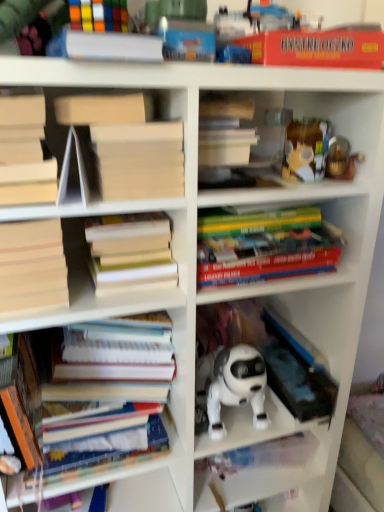
What do you see at coordinates (79, 398) in the screenshot?
I see `hardcover books at left, positioned as the seventh book in top-to-bottom order` at bounding box center [79, 398].

This screenshot has height=512, width=384. I want to click on white matte paper at upper center, the 1th paperback book from the left, so click(110, 46).

Locate an element on the screen. This screenshot has width=384, height=512. hardcover books at center, which is the fourth book in bottom-to-top order is located at coordinates (266, 246).

What do you see at coordinates (341, 159) in the screenshot? I see `metallic gold figurine at upper right, placed as the 2th toy when sorted from left to right` at bounding box center [341, 159].

Describe the element at coordinates (232, 142) in the screenshot. I see `hardcover book at center, the 6th book from the bottom` at that location.

This screenshot has height=512, width=384. I want to click on light brown cardboard book at left, the second book ordered from the bottom, so click(32, 267).

Is hardcover books at center, which ranks as the 5th book in top-to-bottom order, at the right side of translucent plastic container at upper right, arranged as the second toy when viewed from the right?

Incorrect, hardcover books at center, which ranks as the 5th book in top-to-bottom order, is not on the right side of translucent plastic container at upper right, arranged as the second toy when viewed from the right.

Is hardcover books at center, which ranks as the 5th book in top-to-bottom order, in front of or behind translucent plastic container at upper right, arranged as the second toy when viewed from the right, in the image?

Clearly, hardcover books at center, which ranks as the 5th book in top-to-bottom order, is in front of translucent plastic container at upper right, arranged as the second toy when viewed from the right.

Which point is more distant from viewer, (116,275) or (295,153)?

The point (295,153) is farther from the camera.

Is hardcover books at center, which ranks as the 5th book in top-to-bottom order, facing towards translucent plastic container at upper right, which is counted as the 1th toy, starting from the left?

No, hardcover books at center, which ranks as the 5th book in top-to-bottom order, is not aimed at translucent plastic container at upper right, which is counted as the 1th toy, starting from the left.

The height and width of the screenshot is (512, 384). Find the location of `the 2nd toy to the right of the rubberized plastic toy at upper center, counting from the anchor's position`. the 2nd toy to the right of the rubberized plastic toy at upper center, counting from the anchor's position is located at coordinates pyautogui.click(x=341, y=159).

Is metallic gold figurine at upper right, the first toy positioned from the right, to the right of rubberized plastic toy at upper center from the viewer's perspective?

Correct, you'll find metallic gold figurine at upper right, the first toy positioned from the right, to the right of rubberized plastic toy at upper center.

From a real-world perspective, which is physically below, metallic gold figurine at upper right, placed as the 2th toy when sorted from left to right, or rubberized plastic toy at upper center?

metallic gold figurine at upper right, placed as the 2th toy when sorted from left to right.

Find the location of a particular element. the 1st book directly above the hardcover books at center, which is the fourth book in bottom-to-top order (from a real-world perspective) is located at coordinates (232, 142).

Who is more distant, hardcover book at center, the 6th book from the bottom, or hardcover books at center, which is the fourth book from top to bottom?

hardcover book at center, the 6th book from the bottom, is behind.

How many degrees apart are the facing directions of hardcover book at center, which is the second book in top-to-bottom order, and hardcover books at center, which is the fourth book in bottom-to-top order?

They differ by 1.43 degrees in their facing directions.

From the image's perspective, does hardcover book at center, the 6th book from the bottom, appear lower than hardcover books at center, which is the fourth book in bottom-to-top order?

Actually, hardcover book at center, the 6th book from the bottom, appears above hardcover books at center, which is the fourth book in bottom-to-top order, in the image.

From a real-world perspective, is translucent plastic container at upper right, arranged as the second toy when viewed from the right, on top of white matte book at upper left, placed as the third book when sorted from top to bottom?

No, from a real-world perspective, translucent plastic container at upper right, arranged as the second toy when viewed from the right, is not over white matte book at upper left, placed as the third book when sorted from top to bottom

Which object is positioned more to the left, translucent plastic container at upper right, arranged as the second toy when viewed from the right, or white matte book at upper left, placed as the third book when sorted from top to bottom?

white matte book at upper left, placed as the third book when sorted from top to bottom.

Does point (286, 157) come behind point (23, 196)?

That is True.

Measure the distance from translucent plastic container at upper right, arranged as the second toy when viewed from the right, to white matte book at upper left, acting as the fifth book starting from the bottom.

A distance of 17.23 inches exists between translucent plastic container at upper right, arranged as the second toy when viewed from the right, and white matte book at upper left, acting as the fifth book starting from the bottom.

Considering the positions of objects rubberized plastic rubik's cube at upper left, which ranks as the seventh book in bottom-to-top order, and hardcover books at center, the third book from the bottom, in the image provided, who is behind, rubberized plastic rubik's cube at upper left, which ranks as the seventh book in bottom-to-top order, or hardcover books at center, the third book from the bottom,?

hardcover books at center, the third book from the bottom, is further from the camera.

Which is in front, point (95, 13) or point (95, 225)?

Point (95, 13)

Is rubberized plastic rubik's cube at upper left, which ranks as the seventh book in bottom-to-top order, wider or thinner than hardcover books at center, which ranks as the 5th book in top-to-bottom order?

In the image, rubberized plastic rubik's cube at upper left, which ranks as the seventh book in bottom-to-top order, appears to be more narrow than hardcover books at center, which ranks as the 5th book in top-to-bottom order.

From the image's perspective, is white matte paper at upper center, the 1th paperback book from the left, located beneath hardcover books at center, which is the fourth book from top to bottom?

Actually, white matte paper at upper center, the 1th paperback book from the left, appears above hardcover books at center, which is the fourth book from top to bottom, in the image.

Based on the photo, can you confirm if white matte paper at upper center, the 1th paperback book from the left, is thinner than hardcover books at center, which is the fourth book from top to bottom?

Indeed, white matte paper at upper center, the 1th paperback book from the left, has a lesser width compared to hardcover books at center, which is the fourth book from top to bottom.

Can you confirm if white matte paper at upper center, positioned as the 2th paperback book in right-to-left order, is shorter than hardcover books at center, which is the fourth book in bottom-to-top order?

Yes, white matte paper at upper center, positioned as the 2th paperback book in right-to-left order, is shorter than hardcover books at center, which is the fourth book in bottom-to-top order.

At what (x,y) coordinates should I click in order to perform the action: click on the 3rd book located beneath the white matte paper at upper center, the 1th paperback book from the left (from a real-world perspective). Please return your answer as a coordinate pair (x, y). Looking at the image, I should click on (266, 246).

From a real-world perspective, which book is the 1st one above the hardcover books at center, which ranks as the 5th book in top-to-bottom order? Please provide its 2D coordinates.

[(32, 267)]

Looking at this image, considering the sizes of objects light brown cardboard book at left, which ranks as the 6th book in top-to-bottom order, and hardcover books at center, the third book from the bottom, in the image provided, who is smaller, light brown cardboard book at left, which ranks as the 6th book in top-to-bottom order, or hardcover books at center, the third book from the bottom,?

hardcover books at center, the third book from the bottom.

Would you say light brown cardboard book at left, which ranks as the 6th book in top-to-bottom order, contains hardcover books at center, the third book from the bottom?

No, light brown cardboard book at left, which ranks as the 6th book in top-to-bottom order, does not contain hardcover books at center, the third book from the bottom.

You are a GUI agent. You are given a task and a screenshot of the screen. Output one action in this format:
    pyautogui.click(x=<x>, y=<y>)
    Task: Click on the 2nd toy above the hardcover books at center, which ranks as the 5th book in top-to-bottom order (from the image's perspective)
    The width and height of the screenshot is (384, 512).
    Given the screenshot: What is the action you would take?
    pyautogui.click(x=305, y=149)

Find the location of `collection located on the left of metallic gold figurine at upper right, the first toy positioned from the right`. collection located on the left of metallic gold figurine at upper right, the first toy positioned from the right is located at coordinates (340, 10).

Which object lies nearer to the anchor point rubberized plastic rubik's cube at upper left, the first book positioned from the top, hardcover books at left, positioned as the seventh book in top-to-bottom order, or hardcover book at center, the 6th book from the bottom?

Based on the image, hardcover book at center, the 6th book from the bottom, appears to be nearer to rubberized plastic rubik's cube at upper left, the first book positioned from the top.

From the picture: Which object lies nearer to the anchor point hardcover books at center, which is the fourth book from top to bottom, white plastic robot at center or light brown cardboard book at left, which ranks as the 6th book in top-to-bottom order?

white plastic robot at center is closer to hardcover books at center, which is the fourth book from top to bottom.

Considering their positions, is white matte book at upper left, placed as the third book when sorted from top to bottom, positioned closer to hardcover book at center, which is the second book in top-to-bottom order, than translucent plastic container at upper right, arranged as the second toy when viewed from the right?

translucent plastic container at upper right, arranged as the second toy when viewed from the right, is positioned closer to the anchor hardcover book at center, which is the second book in top-to-bottom order.

Based on their spatial positions, is hardcover books at center, which is the fourth book from top to bottom, or translucent plastic container at upper right, arranged as the second toy when viewed from the right, closer to rubberized plastic toy at upper center?

translucent plastic container at upper right, arranged as the second toy when viewed from the right.

Estimate the real-world distances between objects in this image. Which object is further from white matte book at upper left, acting as the fifth book starting from the bottom, translucent plastic container at upper right, which is counted as the 1th toy, starting from the left, or white plastic robot at center?

white plastic robot at center.

Which object lies nearer to the anchor point red matte board game box at upper right, placed as the 1th paperback book when sorted from right to left, hardcover books at left, the first book positioned from the bottom, or hardcover book at center, the 6th book from the bottom?

hardcover book at center, the 6th book from the bottom, is positioned closer to the anchor red matte board game box at upper right, placed as the 1th paperback book when sorted from right to left.

Which object lies nearer to the anchor point white plastic robot at center, translucent plastic container at upper right, arranged as the second toy when viewed from the right, or metallic gold figurine at upper right, the first toy positioned from the right?

translucent plastic container at upper right, arranged as the second toy when viewed from the right, lies closer to white plastic robot at center than the other object.

When comparing their distances from rubberized plastic toy at upper center, does hardcover books at left, the first book positioned from the bottom, or hardcover books at center, the third book from the bottom, seem closer?

hardcover books at center, the third book from the bottom, is positioned closer to the anchor rubberized plastic toy at upper center.

The width and height of the screenshot is (384, 512). What are the coordinates of `toy situated between light brown cardboard book at left, the second book ordered from the bottom, and metallic gold figurine at upper right, the first toy positioned from the right, from left to right` in the screenshot? It's located at (305, 149).

Locate an element on the screen. toy between white matte paper at upper center, positioned as the 2th paperback book in right-to-left order, and metallic gold figurine at upper right, placed as the 2th toy when sorted from left to right is located at coordinates (305, 149).

I want to click on toy between hardcover books at left, the first book positioned from the bottom, and metallic gold figurine at upper right, the first toy positioned from the right, in the horizontal direction, so click(305, 149).

Locate an element on the screen. This screenshot has width=384, height=512. book between rubberized plastic toy at upper center and white matte paper at upper center, positioned as the 2th paperback book in right-to-left order, vertically is located at coordinates (99, 15).